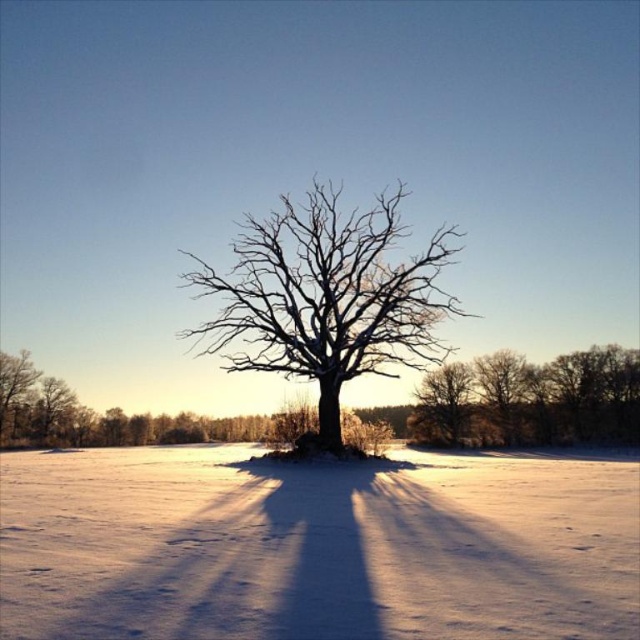
Question: Can you confirm if white powdery snow at center is positioned to the left of bare wood tree at center?

Choices:
 (A) yes
 (B) no

Answer: (B)

Question: Is white powdery snow at center below smooth brown tree at center?

Choices:
 (A) yes
 (B) no

Answer: (B)

Question: Based on their relative distances, which object is nearer to the snow-covered branches at center?

Choices:
 (A) smooth brown tree at center
 (B) white powdery snow at center

Answer: (A)

Question: Which object appears closest to the camera in this image?

Choices:
 (A) white powdery snow at center
 (B) smooth brown tree at center
 (C) bare wood tree at center
 (D) snow-covered branches at center

Answer: (A)

Question: Is the position of white powdery snow at center more distant than that of snow-covered branches at center?

Choices:
 (A) yes
 (B) no

Answer: (B)

Question: Which of the following is the closest to the observer?

Choices:
 (A) (259, 342)
 (B) (483, 424)
 (C) (0, 620)
 (D) (433, 433)

Answer: (C)